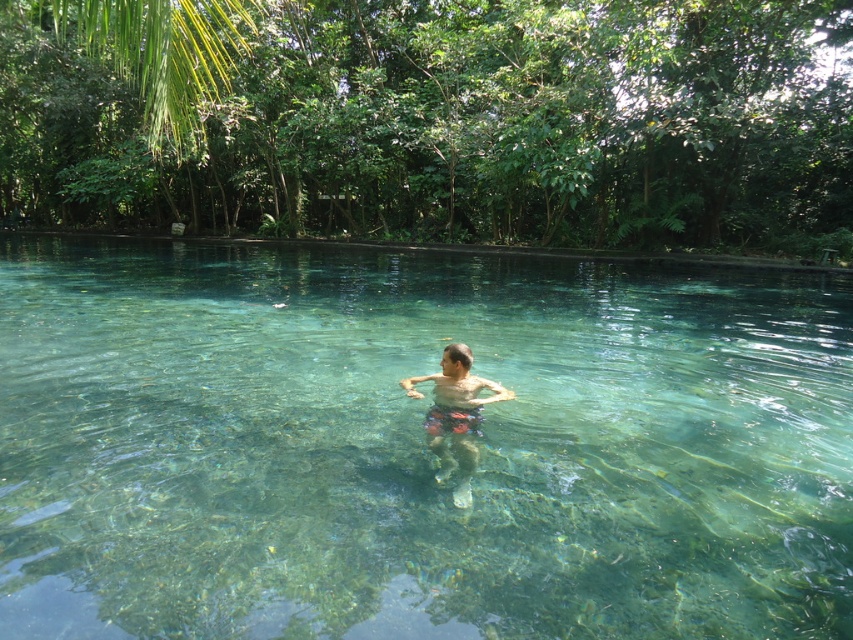
Question: From the image, what is the correct spatial relationship of clear glass pool at center in relation to multicolored swim trunks at center?

Choices:
 (A) left
 (B) right

Answer: (B)

Question: Is clear glass pool at center smaller than multicolored swim trunks at center?

Choices:
 (A) yes
 (B) no

Answer: (B)

Question: Does clear glass pool at center have a lesser width compared to multicolored swim trunks at center?

Choices:
 (A) yes
 (B) no

Answer: (B)

Question: Which object is farther from the camera taking this photo?

Choices:
 (A) multicolored swim trunks at center
 (B) clear glass pool at center

Answer: (A)

Question: Which of the following is the closest to the observer?

Choices:
 (A) multicolored swim trunks at center
 (B) clear glass pool at center

Answer: (B)

Question: Which object appears closest to the camera in this image?

Choices:
 (A) multicolored swim trunks at center
 (B) clear glass pool at center

Answer: (B)